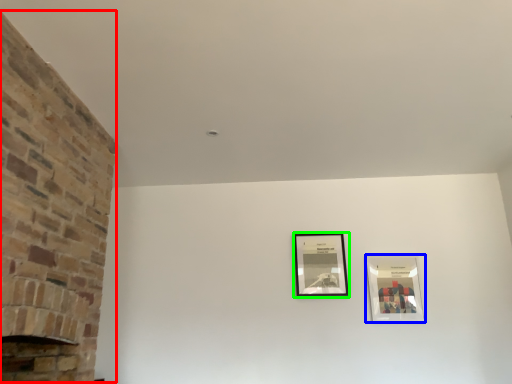
Question: Considering the real-world distances, which object is closest to fireplace (highlighted by a red box)? picture frame (highlighted by a blue box) or picture frame (highlighted by a green box).

Choices:
 (A) picture frame
 (B) picture frame

Answer: (B)